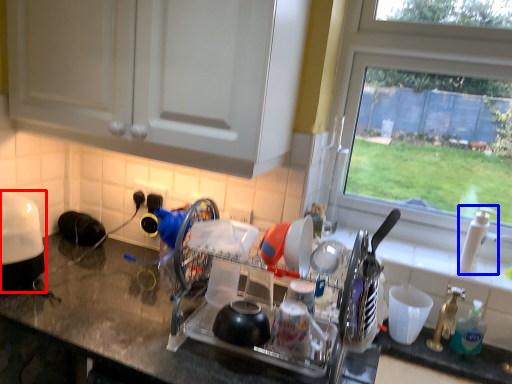
Question: Which of the following is the farthest to the observer, appliance (highlighted by a red box) or faucet (highlighted by a blue box)?

Choices:
 (A) appliance
 (B) faucet

Answer: (B)